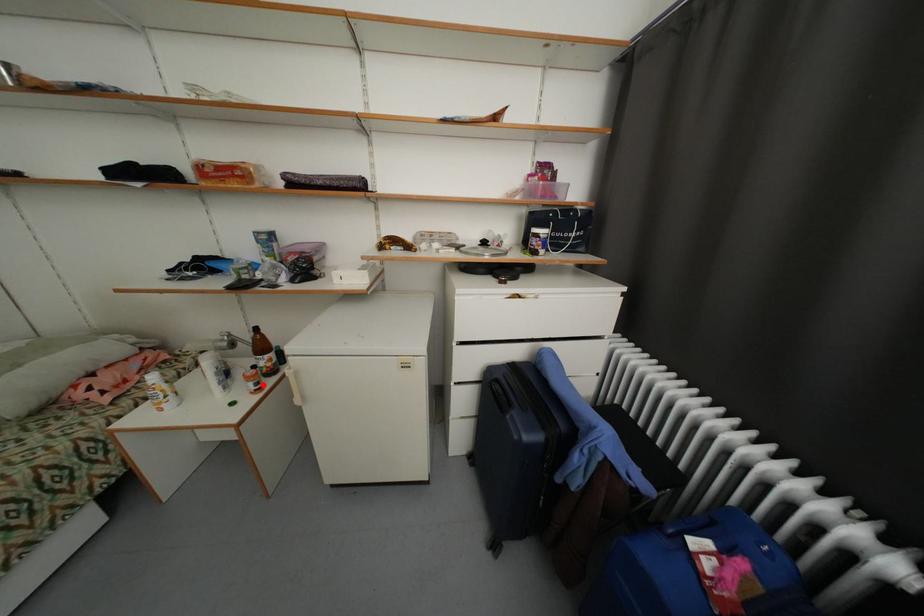
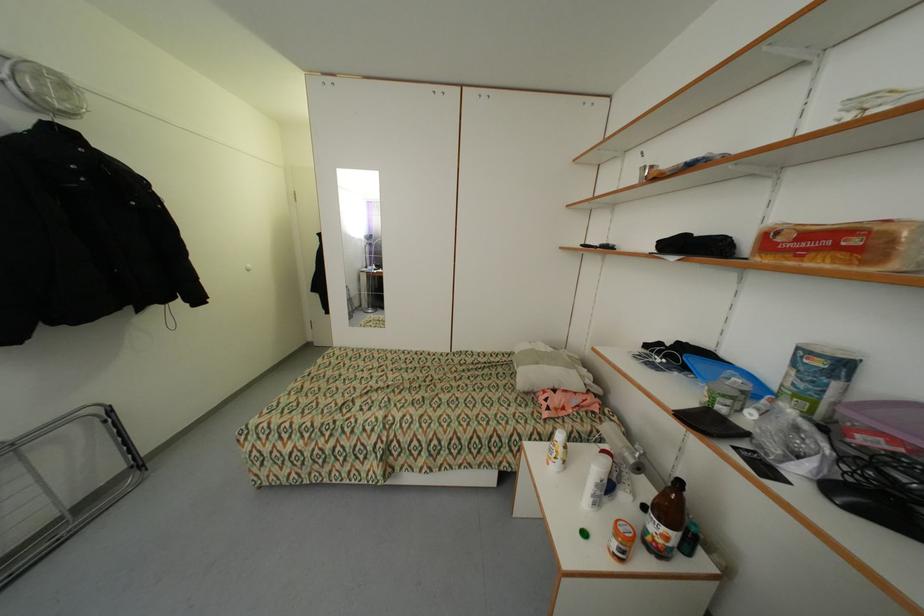
Locate, in the second image, the point that corresponds to the highlighted location in the first image.

(627, 552)